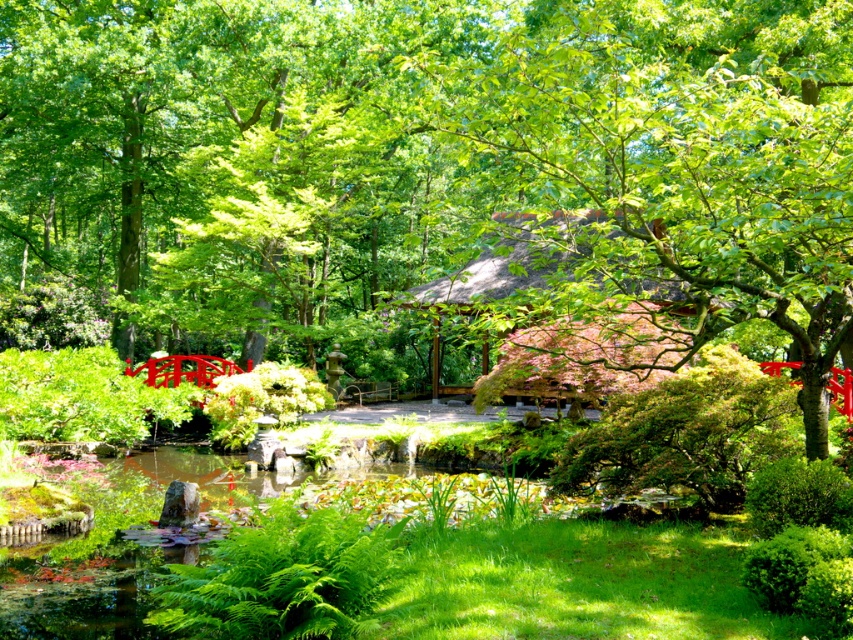
Question: Which of these objects is positioned farthest from the green leafy fern at lower center?

Choices:
 (A) thatched roof hut at center
 (B) green leafy tree at center

Answer: (B)

Question: Which point is farther from the camera taking this photo?

Choices:
 (A) (624, 68)
 (B) (369, 563)
 (C) (648, 376)

Answer: (C)

Question: Which point is farther to the camera?

Choices:
 (A) (802, 179)
 (B) (660, 314)
 (C) (390, 529)

Answer: (B)

Question: Where is green leafy tree at center located in relation to thatched roof hut at center in the image?

Choices:
 (A) right
 (B) left

Answer: (B)

Question: Can you confirm if green leafy tree at center is positioned to the left of thatched roof hut at center?

Choices:
 (A) yes
 (B) no

Answer: (A)

Question: Can you confirm if green leafy fern at lower center is thinner than thatched roof hut at center?

Choices:
 (A) no
 (B) yes

Answer: (B)